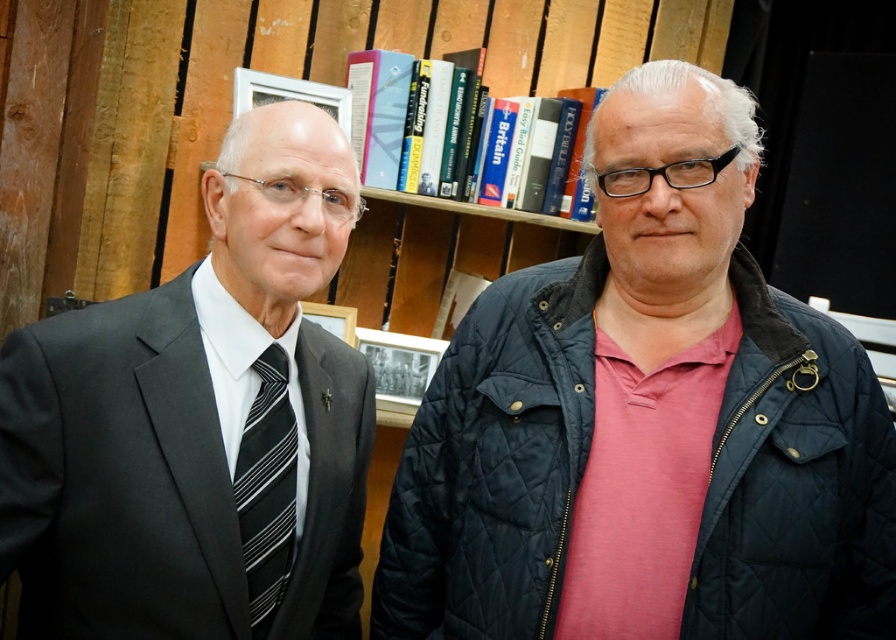
You are a photographer setting up for a group photo. You need to ensure that both the matte black suit at left and the dark blue quilted jacket at right are fully visible in the frame. Based on their positions, which clothing item is closer to the camera?

The matte black suit at left is in front of the dark blue quilted jacket at right, so the matte black suit at left is closer to the camera.

You are taking a photo of two people standing against a bookshelf. You notice two points marked in the image at coordinates point (x=244, y=552) and point (x=285, y=486). Which point is closer to your camera lens?

Point (x=244, y=552) is closer to the camera lens than point (x=285, y=486).

You are a tailor measuring the distance between the matte black suit at left and the black striped tie at left for a custom alteration. The minimum required space for proper stitching is 5 inches. Is the current distance sufficient?

The distance between the matte black suit at left and the black striped tie at left is 4.62 inches, which is less than the required 5 inches. Therefore, the current distance is insufficient for proper stitching.